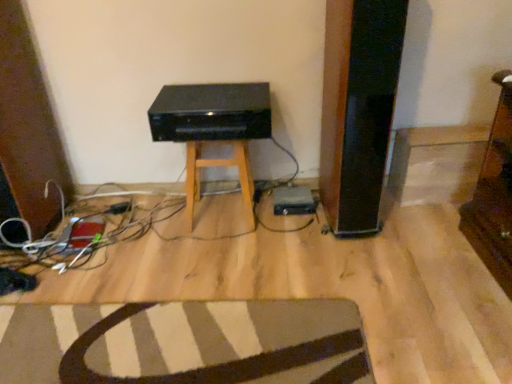
The height and width of the screenshot is (384, 512). I want to click on free location to the right of black plastic plug at lower left, so click(x=144, y=203).